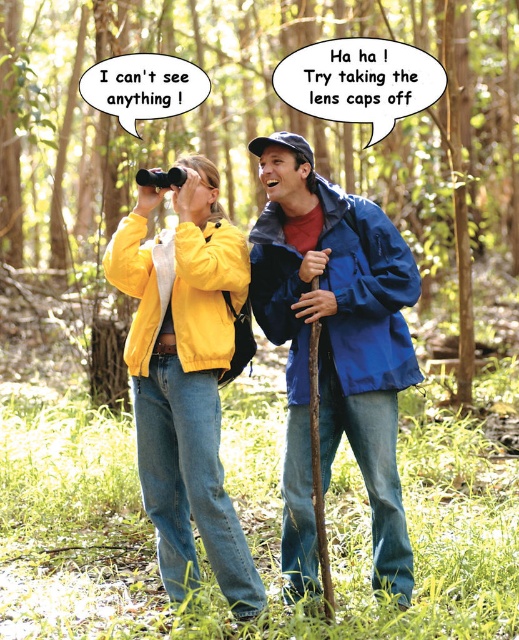
Looking at this image, is green matte forest at center to the right of blue waterproof jacket at center from the viewer's perspective?

No, green matte forest at center is not to the right of blue waterproof jacket at center.

Identify the location of green matte forest at center. This screenshot has width=519, height=640. [248, 132].

Does green matte forest at center have a greater width compared to matte yellow jacket at center?

Yes.

Does green matte forest at center lie behind matte yellow jacket at center?

Yes, green matte forest at center is further from the viewer.

Between point (200, 148) and point (140, 412), which one is positioned behind?

The point (200, 148) is more distant.

You are a GUI agent. You are given a task and a screenshot of the screen. Output one action in this format:
    pyautogui.click(x=<x>, y=<y>)
    Task: Click on the green matte forest at center
    This screenshot has width=519, height=640.
    Given the screenshot: What is the action you would take?
    pyautogui.click(x=248, y=132)

Can you confirm if blue waterproof jacket at center is taller than matte yellow jacket at center?

Yes.

Does point (307, 220) come farther from viewer compared to point (142, 336)?

Yes.

Where is `blue waterproof jacket at center`? The width and height of the screenshot is (519, 640). blue waterproof jacket at center is located at coordinates (334, 348).